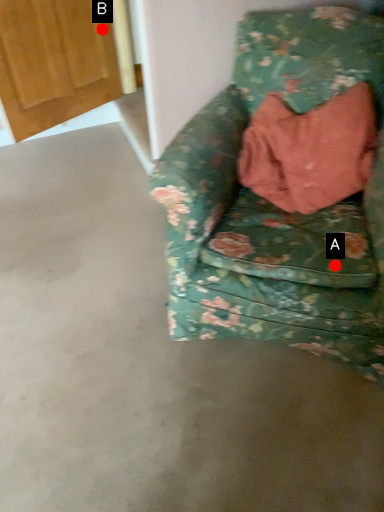
Question: Two points are circled on the image, labeled by A and B beside each circle. Which point appears closest to the camera in this image?

Choices:
 (A) A is closer
 (B) B is closer

Answer: (A)